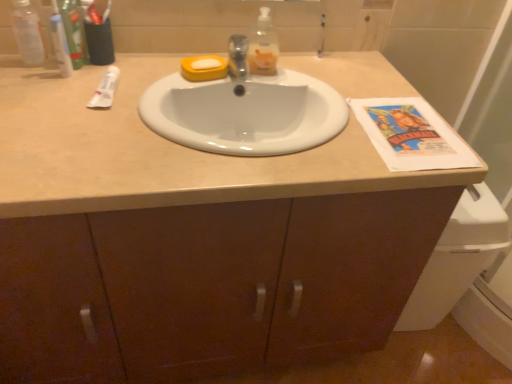
At what (x,y) coordinates should I click in order to perform the action: click on vacant space behind white matte tube at upper left. Please return your answer as a coordinate pair (x, y). The width and height of the screenshot is (512, 384). Looking at the image, I should click on (139, 68).